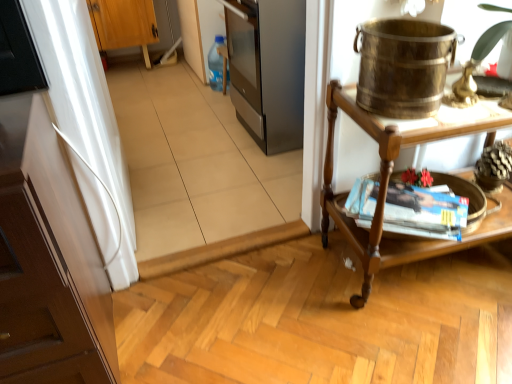
Question: From a real-world perspective, is matte brown magazine at right on white glossy cabinet at left, which is counted as the 1th cabinetry, starting from the right?

Choices:
 (A) yes
 (B) no

Answer: (B)

Question: Is matte brown magazine at right to the left of white glossy cabinet at left, which is the 2th cabinetry from top to bottom, from the viewer's perspective?

Choices:
 (A) yes
 (B) no

Answer: (B)

Question: Does matte brown magazine at right have a greater width compared to white glossy cabinet at left, the 2th cabinetry from the left?

Choices:
 (A) yes
 (B) no

Answer: (B)

Question: Is matte brown magazine at right bigger than white glossy cabinet at left, which is the 2th cabinetry from top to bottom?

Choices:
 (A) no
 (B) yes

Answer: (A)

Question: Would you consider matte brown magazine at right to be distant from white glossy cabinet at left, which is counted as the 1th cabinetry, starting from the right?

Choices:
 (A) no
 (B) yes

Answer: (A)

Question: From a real-world perspective, is matte brown magazine at right beneath white glossy cabinet at left, which is the 2th cabinetry from top to bottom?

Choices:
 (A) no
 (B) yes

Answer: (B)

Question: Is matte brown magazine at right positioned before brass metallic bucket at upper right?

Choices:
 (A) yes
 (B) no

Answer: (B)

Question: Does matte brown magazine at right have a lesser height compared to brass metallic bucket at upper right?

Choices:
 (A) yes
 (B) no

Answer: (A)

Question: Is matte brown magazine at right completely or partially outside of brass metallic bucket at upper right?

Choices:
 (A) yes
 (B) no

Answer: (A)

Question: From the image's perspective, is matte brown magazine at right located above brass metallic bucket at upper right?

Choices:
 (A) no
 (B) yes

Answer: (A)

Question: Does matte brown magazine at right have a smaller size compared to brass metallic bucket at upper right?

Choices:
 (A) no
 (B) yes

Answer: (B)

Question: From a real-world perspective, is matte brown magazine at right positioned over brass metallic bucket at upper right based on gravity?

Choices:
 (A) no
 (B) yes

Answer: (A)

Question: Would you say brass metallic bucket at upper right is a long distance from wooden table at right?

Choices:
 (A) no
 (B) yes

Answer: (A)